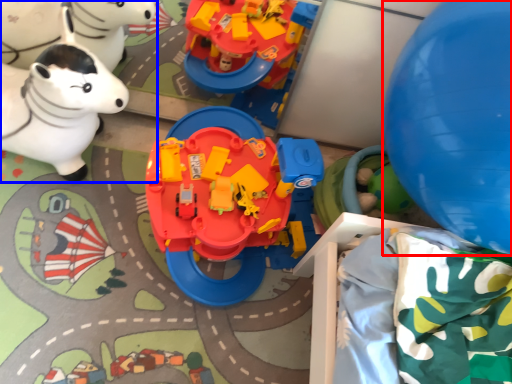
Question: Which object is closer to the camera taking this photo, balloon (highlighted by a red box) or toy (highlighted by a blue box)?

Choices:
 (A) balloon
 (B) toy

Answer: (A)